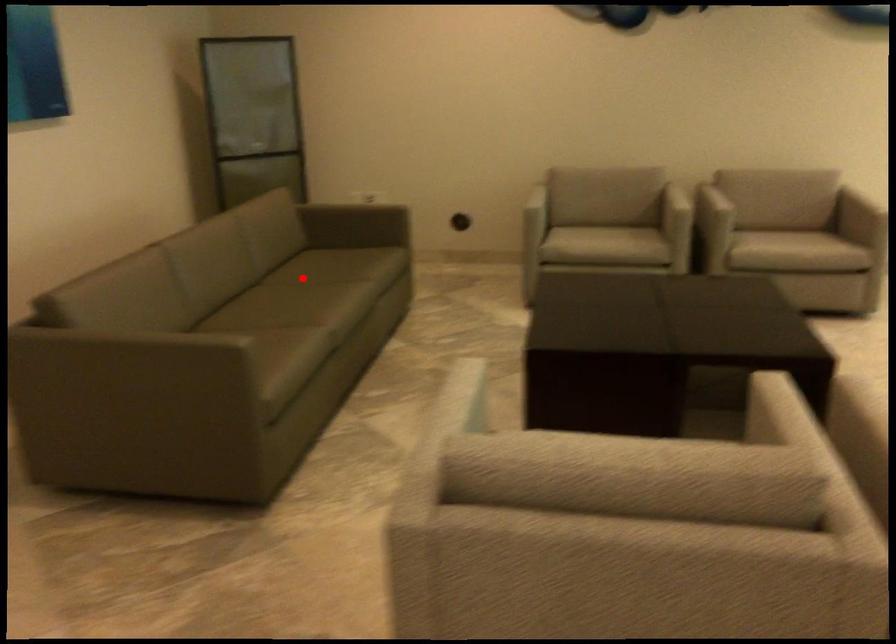
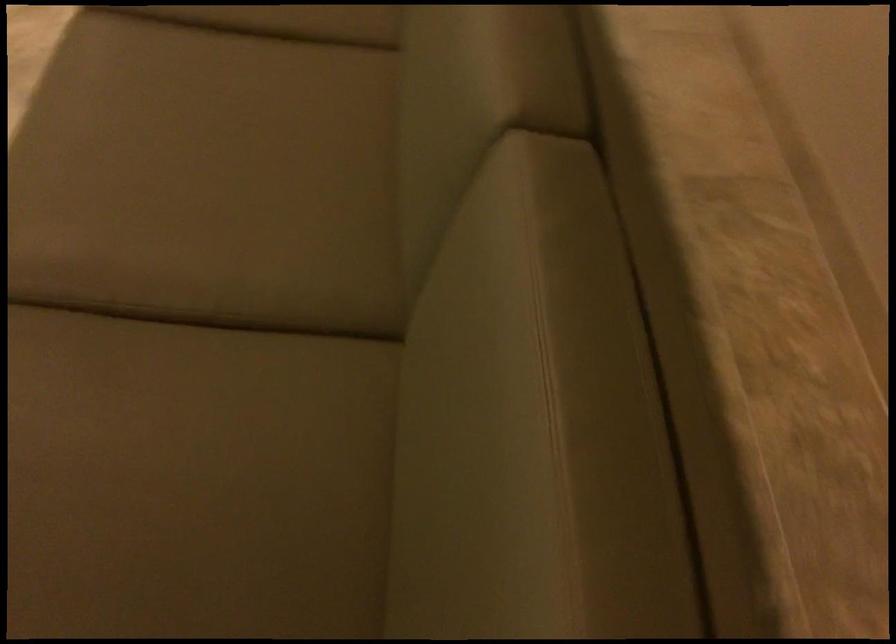
Find the pixel in the second image that matches the highlighted location in the first image.

(211, 339)